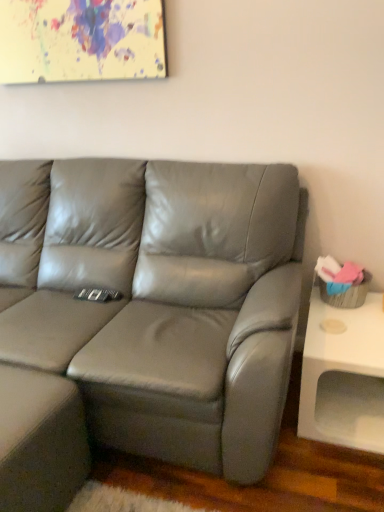
In order to face painted canvas at upper center, should I rotate leftwards or rightwards?

A 15.734 degree turn to the left will do.

This screenshot has height=512, width=384. I want to click on white matte table at right, so click(x=344, y=376).

From the image's perspective, is painted canvas at upper center on top of white matte table at right?

Yes.

Is painted canvas at upper center far from white matte table at right?

That's right, there is a large distance between painted canvas at upper center and white matte table at right.

Is point (161, 51) positioned behind point (376, 324)?

Yes, point (161, 51) is farther from viewer.

Is satin gray leather couch at center further to the viewer compared to matte gray footrest at lower left?

No, the depth of satin gray leather couch at center is less than that of matte gray footrest at lower left.

This screenshot has height=512, width=384. In order to click on the footrest that appears below the satin gray leather couch at center (from a real-world perspective) in this screenshot , I will do `click(40, 441)`.

Do you think satin gray leather couch at center is within matte gray footrest at lower left, or outside of it?

satin gray leather couch at center cannot be found inside matte gray footrest at lower left.

Considering the relative positions of matte gray footrest at lower left and painted canvas at upper center in the image provided, is matte gray footrest at lower left to the left of painted canvas at upper center from the viewer's perspective?

Indeed, matte gray footrest at lower left is positioned on the left side of painted canvas at upper center.

In terms of height, does matte gray footrest at lower left look taller or shorter compared to painted canvas at upper center?

Considering their sizes, matte gray footrest at lower left has more height than painted canvas at upper center.

Between matte gray footrest at lower left and painted canvas at upper center, which one has smaller width?

Thinner between the two is painted canvas at upper center.

Is matte gray footrest at lower left facing away from painted canvas at upper center?

No, matte gray footrest at lower left is not facing away from painted canvas at upper center.

Is the depth of white matte table at right less than that of satin gray leather couch at center?

No.

Considering the points (333, 402) and (163, 244), which point is behind, point (333, 402) or point (163, 244)?

The point (163, 244) is farther.

From the image's perspective, between white matte table at right and satin gray leather couch at center, which one is located above?

From the image's view, satin gray leather couch at center is above.

Does white matte table at right have a greater width compared to satin gray leather couch at center?

No.

Does white matte table at right have a lesser width compared to matte gray footrest at lower left?

No, white matte table at right is not thinner than matte gray footrest at lower left.

Could you tell me if white matte table at right is facing matte gray footrest at lower left?

No.

Is white matte table at right facing away from painted canvas at upper center?

white matte table at right does not have its back to painted canvas at upper center.

Locate an element on the screen. picture frame behind the white matte table at right is located at coordinates (81, 40).

From their relative heights in the image, would you say white matte table at right is taller or shorter than painted canvas at upper center?

In the image, white matte table at right appears to be shorter than painted canvas at upper center.

Is white matte table at right smaller than painted canvas at upper center?

No, white matte table at right is not smaller than painted canvas at upper center.

From a real-world perspective, is painted canvas at upper center physically located above or below satin gray leather couch at center?

painted canvas at upper center is situated higher than satin gray leather couch at center in the real world.

From their relative heights in the image, would you say painted canvas at upper center is taller or shorter than satin gray leather couch at center?

Clearly, painted canvas at upper center is shorter compared to satin gray leather couch at center.

Is painted canvas at upper center wider or thinner than satin gray leather couch at center?

Clearly, painted canvas at upper center has less width compared to satin gray leather couch at center.

You are a GUI agent. You are given a task and a screenshot of the screen. Output one action in this format:
    pyautogui.click(x=<x>, y=<y>)
    Task: Click on the picture frame located behind the white matte table at right
    
    Given the screenshot: What is the action you would take?
    pyautogui.click(x=81, y=40)

I want to click on studio couch that appears above the matte gray footrest at lower left (from the image's perspective), so click(168, 306).

Considering their positions, is painted canvas at upper center positioned closer to white matte table at right than satin gray leather couch at center?

satin gray leather couch at center.

From the image, which object appears to be nearer to painted canvas at upper center, satin gray leather couch at center or white matte table at right?

The object closer to painted canvas at upper center is satin gray leather couch at center.

Consider the image. Based on their spatial positions, is matte gray footrest at lower left or satin gray leather couch at center closer to painted canvas at upper center?

satin gray leather couch at center lies closer to painted canvas at upper center than the other object.

Estimate the real-world distances between objects in this image. Which object is further from matte gray footrest at lower left, satin gray leather couch at center or painted canvas at upper center?

painted canvas at upper center is positioned further to the anchor matte gray footrest at lower left.

Estimate the real-world distances between objects in this image. Which object is further from satin gray leather couch at center, painted canvas at upper center or white matte table at right?

Based on the image, painted canvas at upper center appears to be further to satin gray leather couch at center.

Based on their spatial positions, is white matte table at right or satin gray leather couch at center closer to matte gray footrest at lower left?

The object closer to matte gray footrest at lower left is satin gray leather couch at center.

Estimate the real-world distances between objects in this image. Which object is closer to painted canvas at upper center, satin gray leather couch at center or matte gray footrest at lower left?

satin gray leather couch at center is closer to painted canvas at upper center.

Estimate the real-world distances between objects in this image. Which object is closer to white matte table at right, satin gray leather couch at center or matte gray footrest at lower left?

satin gray leather couch at center is positioned closer to the anchor white matte table at right.

What are the coordinates of `table between painted canvas at upper center and matte gray footrest at lower left vertically` in the screenshot? It's located at (344, 376).

Image resolution: width=384 pixels, height=512 pixels. I want to click on studio couch between matte gray footrest at lower left and white matte table at right from left to right, so pyautogui.click(x=168, y=306).

Where is `studio couch between painted canvas at upper center and white matte table at right in the up-down direction`? This screenshot has height=512, width=384. studio couch between painted canvas at upper center and white matte table at right in the up-down direction is located at coordinates (168, 306).

What are the coordinates of `studio couch between painted canvas at upper center and matte gray footrest at lower left in the up-down direction` in the screenshot? It's located at (168, 306).